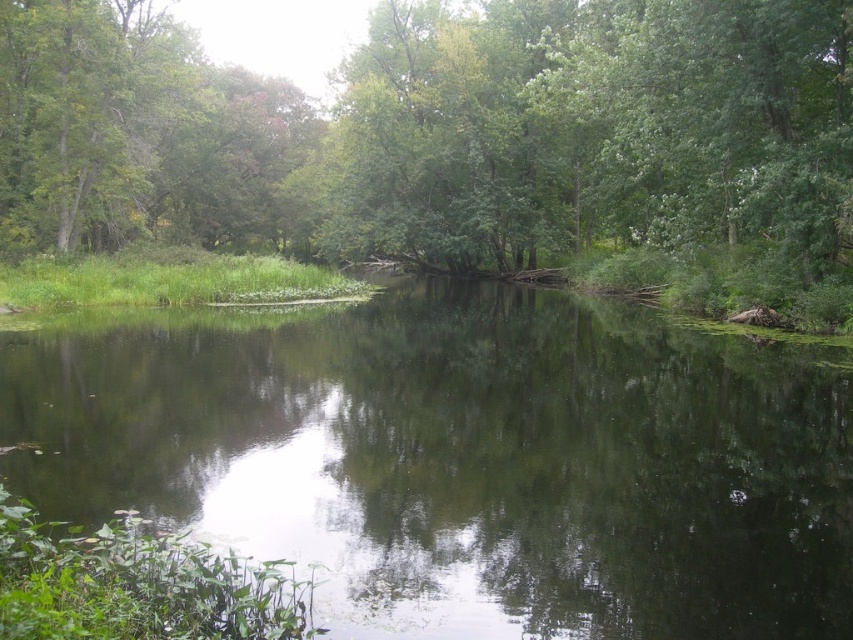
Who is higher up, green reflective water at center or green leafy tree at center?

green leafy tree at center

Which is more to the right, green reflective water at center or green leafy tree at center?

green reflective water at center is more to the right.

What do you see at coordinates (461, 458) in the screenshot?
I see `green reflective water at center` at bounding box center [461, 458].

Where is `green reflective water at center`? The height and width of the screenshot is (640, 853). green reflective water at center is located at coordinates (461, 458).